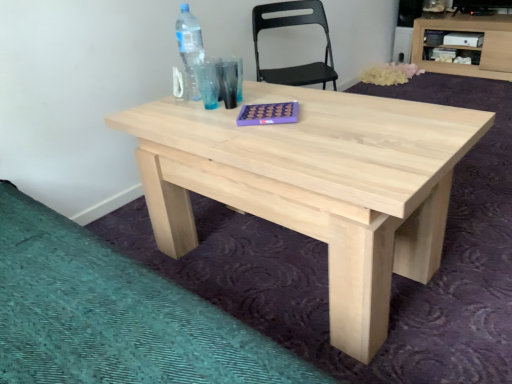
Where is `light wood/unfinished wood computer desk at upper right`? light wood/unfinished wood computer desk at upper right is located at coordinates (470, 48).

Measure the distance between natural wood table at center and camera.

They are 34.04 inches apart.

The image size is (512, 384). What do you see at coordinates (189, 47) in the screenshot?
I see `transparent plastic bottle at upper left` at bounding box center [189, 47].

This screenshot has height=384, width=512. What are the coordinates of `black plastic chair at upper center` in the screenshot? It's located at (x=294, y=25).

In the scene shown: Considering their positions, is light wood/unfinished wood computer desk at upper right located in front of or behind natural wood table at center?

light wood/unfinished wood computer desk at upper right is behind natural wood table at center.

From the image's perspective, does light wood/unfinished wood computer desk at upper right appear lower than natural wood table at center?

Incorrect, from the image's perspective, light wood/unfinished wood computer desk at upper right is higher than natural wood table at center.

How far apart are light wood/unfinished wood computer desk at upper right and natural wood table at center?

light wood/unfinished wood computer desk at upper right and natural wood table at center are 8.72 feet apart.

Are light wood/unfinished wood computer desk at upper right and natural wood table at center making contact?

light wood/unfinished wood computer desk at upper right is not next to natural wood table at center, and they're not touching.

Considering the sizes of light wood/unfinished wood computer desk at upper right and black plastic chair at upper center in the image, is light wood/unfinished wood computer desk at upper right wider or thinner than black plastic chair at upper center?

In the image, light wood/unfinished wood computer desk at upper right appears to be wider than black plastic chair at upper center.

The image size is (512, 384). Find the location of `computer desk to the right of black plastic chair at upper center`. computer desk to the right of black plastic chair at upper center is located at coordinates (470, 48).

Does light wood/unfinished wood computer desk at upper right have a larger size compared to black plastic chair at upper center?

Yes.

Measure the distance from light wood/unfinished wood computer desk at upper right to black plastic chair at upper center.

A distance of 5.13 feet exists between light wood/unfinished wood computer desk at upper right and black plastic chair at upper center.

Does natural wood table at center have a smaller size compared to transparent plastic bottle at upper left?

No, natural wood table at center is not smaller than transparent plastic bottle at upper left.

Is natural wood table at center positioned beyond the bounds of transparent plastic bottle at upper left?

natural wood table at center lies outside transparent plastic bottle at upper left's area.

From a real-world perspective, who is located higher, natural wood table at center or transparent plastic bottle at upper left?

In real-world perspective, transparent plastic bottle at upper left is above.

How many degrees apart are the facing directions of natural wood table at center and transparent plastic bottle at upper left?

1.52 degrees.

You are a GUI agent. You are given a task and a screenshot of the screen. Output one action in this format:
    pyautogui.click(x=<x>, y=<y>)
    Task: Click on the chair on the right of transparent plastic bottle at upper left
    
    Given the screenshot: What is the action you would take?
    pyautogui.click(x=294, y=25)

From a real-world perspective, does transparent plastic bottle at upper left stand above black plastic chair at upper center?

Yes.

From the picture: Which object is further away from the camera taking this photo, transparent plastic bottle at upper left or black plastic chair at upper center?

black plastic chair at upper center.

What's the angular difference between transparent plastic bottle at upper left and black plastic chair at upper center's facing directions?

They differ by 127 degrees in their facing directions.

Is light wood/unfinished wood computer desk at upper right completely or partially inside transparent plastic bottle at upper left?

No, light wood/unfinished wood computer desk at upper right is not a part of transparent plastic bottle at upper left.

I want to click on computer desk lying on the right of transparent plastic bottle at upper left, so click(470, 48).

From their relative heights in the image, would you say transparent plastic bottle at upper left is taller or shorter than light wood/unfinished wood computer desk at upper right?

In the image, transparent plastic bottle at upper left appears to be shorter than light wood/unfinished wood computer desk at upper right.

In the image, there is a black plastic chair at upper center. Identify the location of table below it (from the image's perspective). (315, 185).

From a real-world perspective, between natural wood table at center and black plastic chair at upper center, who is vertically higher?

From a 3D spatial view, black plastic chair at upper center is above.

Is black plastic chair at upper center surrounded by natural wood table at center?

Actually, black plastic chair at upper center is outside natural wood table at center.

How different are the orientations of natural wood table at center and black plastic chair at upper center in degrees?

The angular difference between natural wood table at center and black plastic chair at upper center is 128 degrees.

Where is `table in front of the light wood/unfinished wood computer desk at upper right`? This screenshot has height=384, width=512. table in front of the light wood/unfinished wood computer desk at upper right is located at coordinates (315, 185).

Consider the image. From the image's perspective, would you say natural wood table at center is positioned over light wood/unfinished wood computer desk at upper right?

Actually, natural wood table at center appears below light wood/unfinished wood computer desk at upper right in the image.

Is natural wood table at center inside the boundaries of light wood/unfinished wood computer desk at upper right, or outside?

natural wood table at center is not inside light wood/unfinished wood computer desk at upper right, it's outside.

The width and height of the screenshot is (512, 384). I want to click on computer desk above the natural wood table at center (from the image's perspective), so click(470, 48).

The height and width of the screenshot is (384, 512). I want to click on computer desk below the black plastic chair at upper center (from a real-world perspective), so click(470, 48).

When comparing their distances from transparent plastic bottle at upper left, does light wood/unfinished wood computer desk at upper right or black plastic chair at upper center seem further?

The object further to transparent plastic bottle at upper left is light wood/unfinished wood computer desk at upper right.

Looking at the image, which one is located further to black plastic chair at upper center, light wood/unfinished wood computer desk at upper right or natural wood table at center?

Among the two, light wood/unfinished wood computer desk at upper right is located further to black plastic chair at upper center.

When comparing their distances from transparent plastic bottle at upper left, does black plastic chair at upper center or natural wood table at center seem closer?

natural wood table at center.

Based on their spatial positions, is natural wood table at center or transparent plastic bottle at upper left closer to black plastic chair at upper center?

transparent plastic bottle at upper left lies closer to black plastic chair at upper center than the other object.

Based on their spatial positions, is light wood/unfinished wood computer desk at upper right or black plastic chair at upper center further from natural wood table at center?

light wood/unfinished wood computer desk at upper right lies further to natural wood table at center than the other object.

Based on the photo, looking at the image, which one is located further to natural wood table at center, transparent plastic bottle at upper left or black plastic chair at upper center?

The object further to natural wood table at center is black plastic chair at upper center.

When comparing their distances from natural wood table at center, does black plastic chair at upper center or transparent plastic bottle at upper left seem further?

Based on the image, black plastic chair at upper center appears to be further to natural wood table at center.

Which object lies nearer to the anchor point light wood/unfinished wood computer desk at upper right, black plastic chair at upper center or transparent plastic bottle at upper left?

black plastic chair at upper center is closer to light wood/unfinished wood computer desk at upper right.

Locate an element on the screen. The image size is (512, 384). chair between transparent plastic bottle at upper left and natural wood table at center from left to right is located at coordinates (294, 25).

Locate an element on the screen. This screenshot has height=384, width=512. chair between transparent plastic bottle at upper left and light wood/unfinished wood computer desk at upper right from left to right is located at coordinates (294, 25).

Where is `bottle between natural wood table at center and light wood/unfinished wood computer desk at upper right along the z-axis`? bottle between natural wood table at center and light wood/unfinished wood computer desk at upper right along the z-axis is located at coordinates (189, 47).

This screenshot has height=384, width=512. Find the location of `chair between natural wood table at center and light wood/unfinished wood computer desk at upper right in the front-back direction`. chair between natural wood table at center and light wood/unfinished wood computer desk at upper right in the front-back direction is located at coordinates (294, 25).